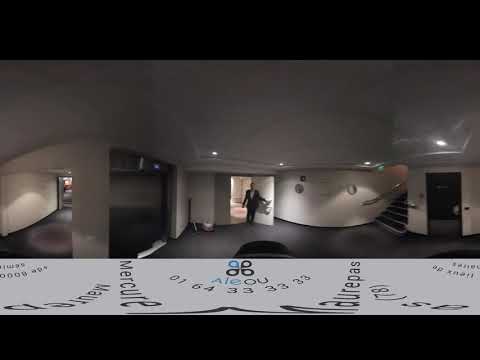
Locate an element on the screen. The height and width of the screenshot is (360, 480). floor is located at coordinates (331, 238), (47, 236).